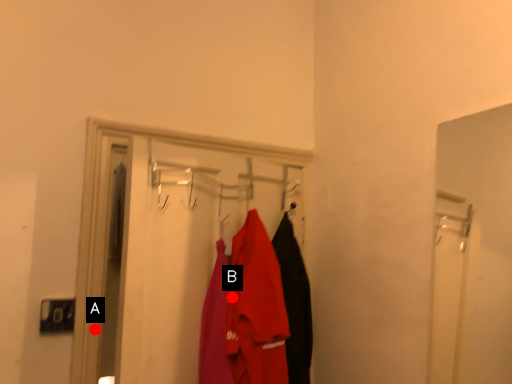
Question: Two points are circled on the image, labeled by A and B beside each circle. Which point appears closest to the camera in this image?

Choices:
 (A) A is closer
 (B) B is closer

Answer: (B)